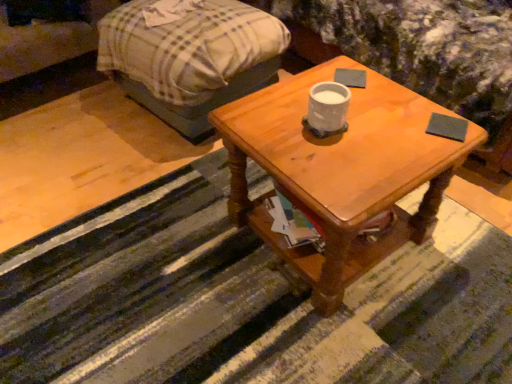
Question: Is wooden coffee table at center in front of or behind plaid fabric bed at upper left in the image?

Choices:
 (A) behind
 (B) front

Answer: (B)

Question: From the image's perspective, is wooden coffee table at center positioned above or below plaid fabric bed at upper left?

Choices:
 (A) below
 (B) above

Answer: (A)

Question: Which is nearer to the wooden coffee table at center?

Choices:
 (A) dark gray matte pad at upper center, placed as the second pad when sorted from bottom to top
 (B) wooden table at center
 (C) plaid fabric couch at upper left
 (D) dark gray matte pad at upper right, the first pad when ordered from right to left
 (E) plaid fabric bed at upper left

Answer: (D)

Question: Based on their relative distances, which object is farther from the dark gray matte pad at upper right, the second pad in the left-to-right sequence?

Choices:
 (A) wooden coffee table at center
 (B) wooden table at center
 (C) plaid fabric bed at upper left
 (D) plaid fabric couch at upper left
 (E) dark gray matte pad at upper center, which appears as the 1th pad when viewed from the top

Answer: (D)